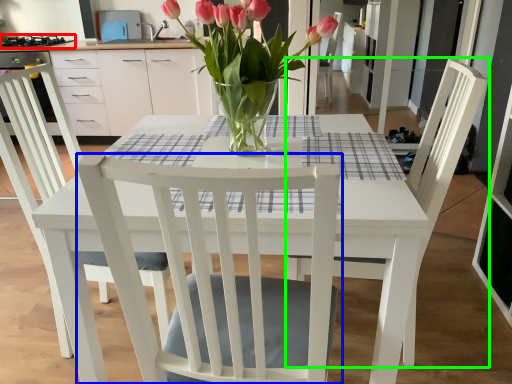
Question: Considering the real-world distances, which object is closest to appliance (highlighted by a red box)? chair (highlighted by a blue box) or chair (highlighted by a green box).

Choices:
 (A) chair
 (B) chair

Answer: (B)